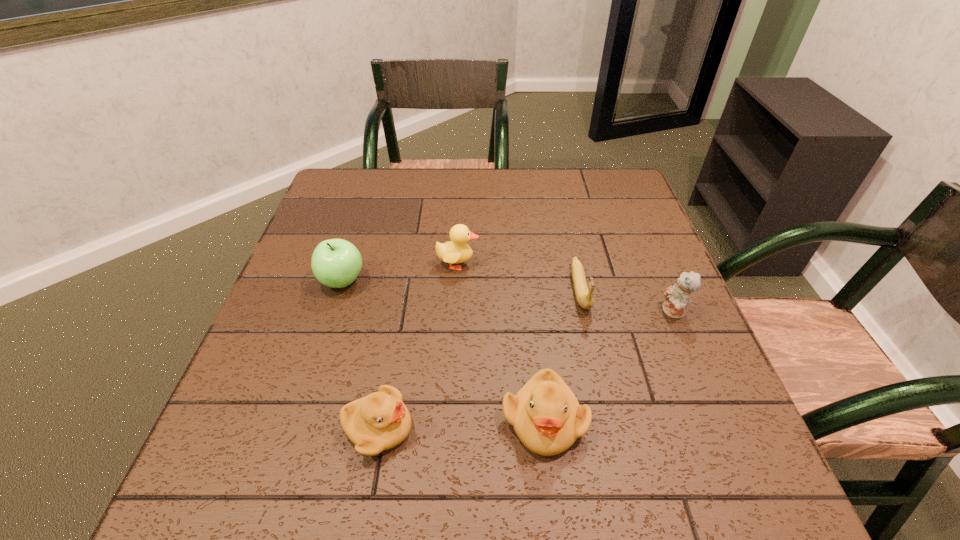
At what (x,y) coordinates should I click in order to perform the action: click on vacant place for an extra duckling on the right. Please return your answer as a coordinate pair (x, y). Looking at the image, I should click on 705,412.